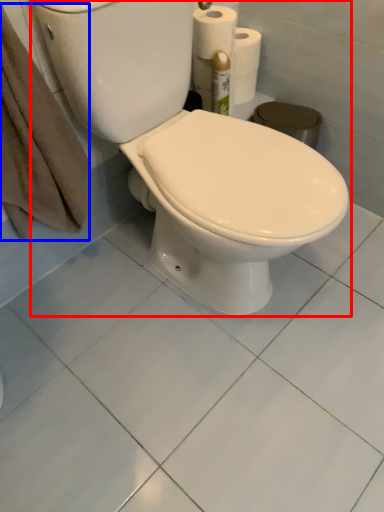
Question: Which object is further to the camera taking this photo, toilet (highlighted by a red box) or bath towel (highlighted by a blue box)?

Choices:
 (A) toilet
 (B) bath towel

Answer: (B)